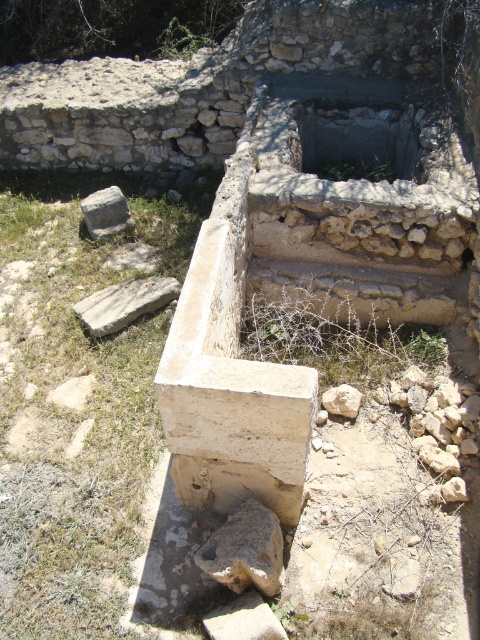
Does light brown stone at lower left have a greater width compared to gray rough stone at lower left?

Indeed, light brown stone at lower left has a greater width compared to gray rough stone at lower left.

Does light brown stone at lower left have a greater height compared to gray rough stone at lower left?

No.

In order to click on light brown stone at lower left in this screenshot , I will do `click(124, 304)`.

This screenshot has width=480, height=640. Identify the location of light brown stone at lower left. (124, 304).

Who is shorter, brown rough stone at lower center or white stone at center?

Standing shorter between the two is white stone at center.

Does brown rough stone at lower center have a larger size compared to white stone at center?

Yes.

Does point (214, 536) lie in front of point (330, 396)?

Yes.

Where is `brown rough stone at lower center`? This screenshot has width=480, height=640. brown rough stone at lower center is located at coordinates (245, 550).

Who is more distant from viewer, (171, 294) or (345, 387)?

Point (171, 294)

Can you confirm if light brown stone at lower left is positioned above white stone at center?

Yes, light brown stone at lower left is above white stone at center.

Is point (169, 285) closer to camera compared to point (336, 412)?

That is False.

This screenshot has height=640, width=480. I want to click on light brown stone at lower left, so click(124, 304).